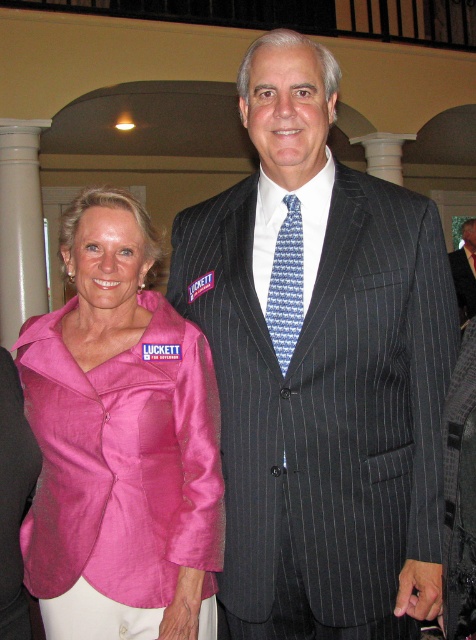
Can you confirm if dark gray pinstripe suit at center is positioned to the left of pinstriped suit at center?

Indeed, dark gray pinstripe suit at center is positioned on the left side of pinstriped suit at center.

Which is more to the left, dark gray pinstripe suit at center or pinstriped suit at center?

dark gray pinstripe suit at center

Who is more forward, (335,326) or (469,314)?

Point (335,326)

The width and height of the screenshot is (476, 640). Find the location of `dark gray pinstripe suit at center`. dark gray pinstripe suit at center is located at coordinates (321, 371).

Does pink satin blazer at left have a lesser width compared to pinstriped suit at center?

Correct, pink satin blazer at left's width is less than pinstriped suit at center's.

Locate an element on the screen. Image resolution: width=476 pixels, height=640 pixels. pink satin blazer at left is located at coordinates (120, 444).

Which is behind, point (430, 356) or point (296, 252)?

Positioned behind is point (296, 252).

Is dark gray pinstripe suit at center positioned at the back of blue printed tie at center?

No, dark gray pinstripe suit at center is in front of blue printed tie at center.

Who is more distant from viewer, (x=235, y=512) or (x=297, y=268)?

The point (x=235, y=512) is more distant.

What are the coordinates of `dark gray pinstripe suit at center` in the screenshot? It's located at (321, 371).